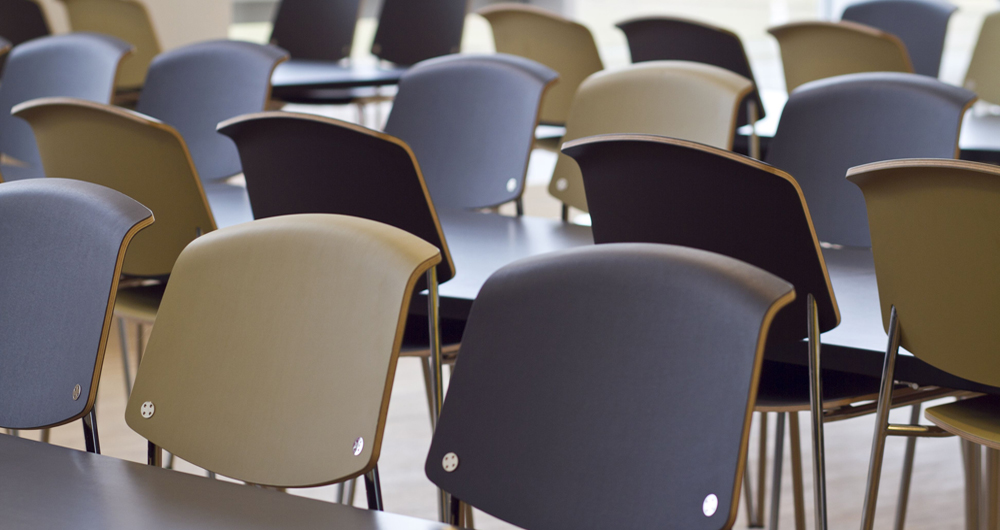
The image size is (1000, 530). What are the coordinates of `the back of chair` in the screenshot? It's located at click(x=353, y=150), click(x=116, y=155), click(x=103, y=17), click(x=22, y=14), click(x=528, y=31), click(x=683, y=36), click(x=820, y=49), click(x=736, y=211), click(x=957, y=215).